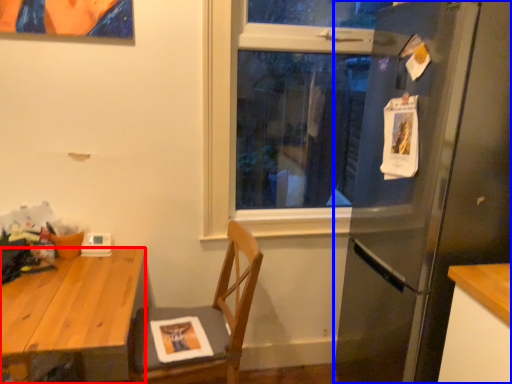
Question: Which point is closer to the camera, desk (highlighted by a red box) or refrigerator (highlighted by a blue box)?

Choices:
 (A) desk
 (B) refrigerator

Answer: (A)